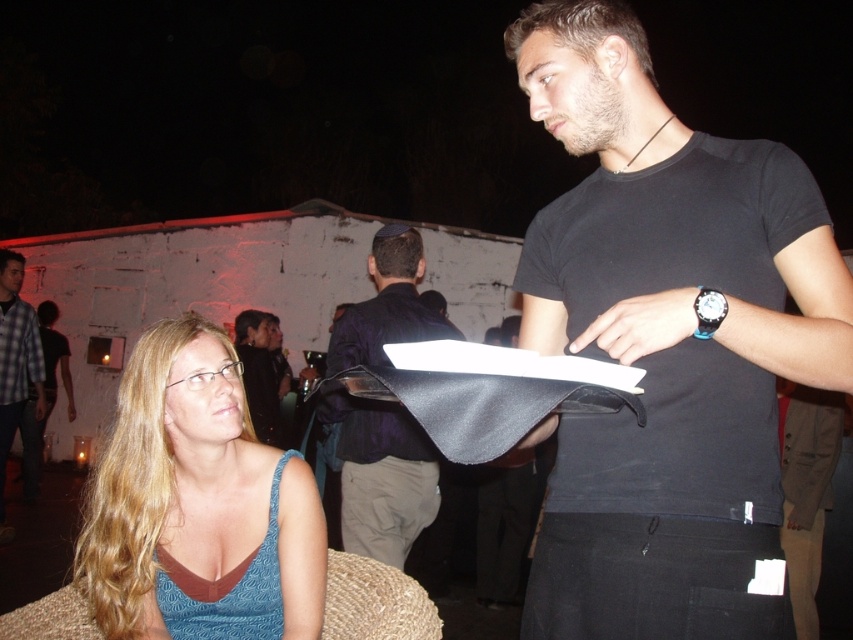
Can you confirm if dark blue fabric at center is positioned below checkered fabric shirt at left?

Actually, dark blue fabric at center is above checkered fabric shirt at left.

Does point (402, 532) lie in front of point (3, 429)?

Yes.

The height and width of the screenshot is (640, 853). What are the coordinates of `dark blue fabric at center` in the screenshot? It's located at (381, 476).

Which is in front, point (42, 410) or point (248, 368)?

Positioned in front is point (248, 368).

Does point (4, 352) lie behind point (248, 365)?

Yes, it is behind point (248, 365).

Where is `checkered fabric shirt at left`? This screenshot has height=640, width=853. checkered fabric shirt at left is located at coordinates (15, 362).

Does point (375, 314) come closer to viewer compared to point (263, 426)?

Yes.

Between dark blue fabric at center and dark blue shirt at center, which one has less height?

dark blue shirt at center is shorter.

The width and height of the screenshot is (853, 640). What are the coordinates of `dark blue fabric at center` in the screenshot? It's located at 381,476.

Identify the location of dark blue fabric at center. (381, 476).